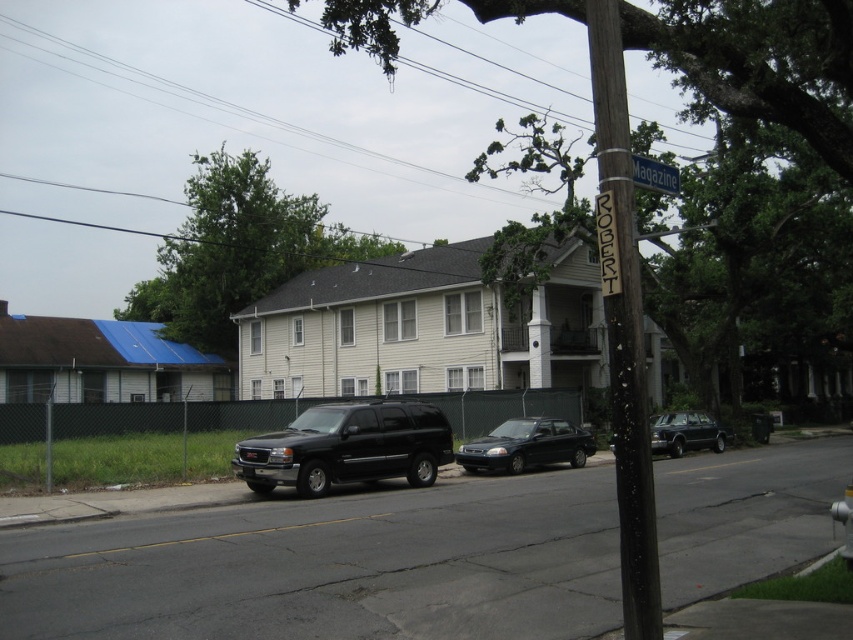
Question: Based on their relative distances, which object is farther from the black matte suv at center?

Choices:
 (A) green metallic street sign at upper center
 (B) shiny black sedan at center

Answer: (A)

Question: Can you confirm if dark brown wooden telegraph pole at center is positioned above shiny black limousine at center-right?

Choices:
 (A) yes
 (B) no

Answer: (A)

Question: Is dark brown wooden telegraph pole at center positioned before green metallic street sign at upper center?

Choices:
 (A) yes
 (B) no

Answer: (A)

Question: Is the position of dark brown wooden telegraph pole at center less distant than that of shiny black limousine at center-right?

Choices:
 (A) no
 (B) yes

Answer: (A)

Question: Based on their relative distances, which object is farther from the dark brown wooden telegraph pole at center?

Choices:
 (A) green metallic street sign at upper center
 (B) shiny black limousine at center-right

Answer: (A)

Question: Among these points, which one is farthest from the camera?

Choices:
 (A) (639, 172)
 (B) (659, 413)
 (C) (473, 470)

Answer: (B)